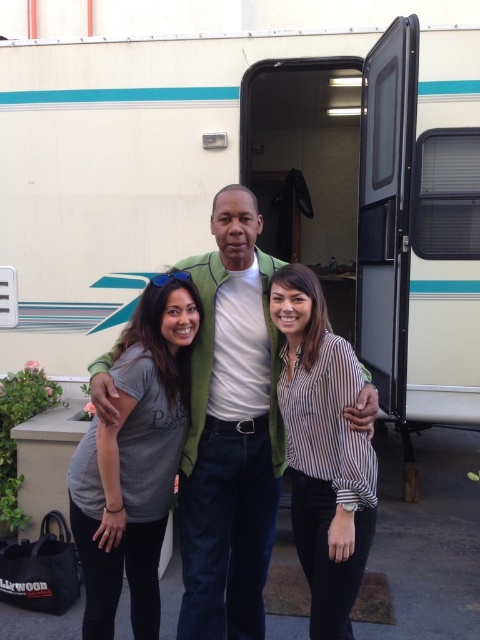
Question: Does green matte jacket at center have a larger size compared to striped fabric shirt at center?

Choices:
 (A) no
 (B) yes

Answer: (B)

Question: Which object is the closest to the gray cotton t-shirt at center?

Choices:
 (A) striped fabric shirt at center
 (B) green matte jacket at center

Answer: (B)

Question: Estimate the real-world distances between objects in this image. Which object is farther from the striped fabric shirt at center?

Choices:
 (A) green matte jacket at center
 (B) gray cotton t-shirt at center

Answer: (B)

Question: Which object is the closest to the green matte jacket at center?

Choices:
 (A) striped fabric shirt at center
 (B) gray cotton t-shirt at center

Answer: (B)

Question: Can you confirm if gray cotton t-shirt at center is thinner than striped fabric shirt at center?

Choices:
 (A) yes
 (B) no

Answer: (B)

Question: Does gray cotton t-shirt at center have a greater width compared to striped fabric shirt at center?

Choices:
 (A) no
 (B) yes

Answer: (B)